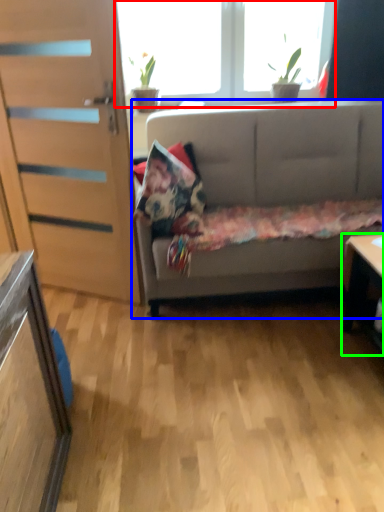
Question: Which is farther away from window (highlighted by a red box)? studio couch (highlighted by a blue box) or desk (highlighted by a green box)?

Choices:
 (A) studio couch
 (B) desk

Answer: (B)